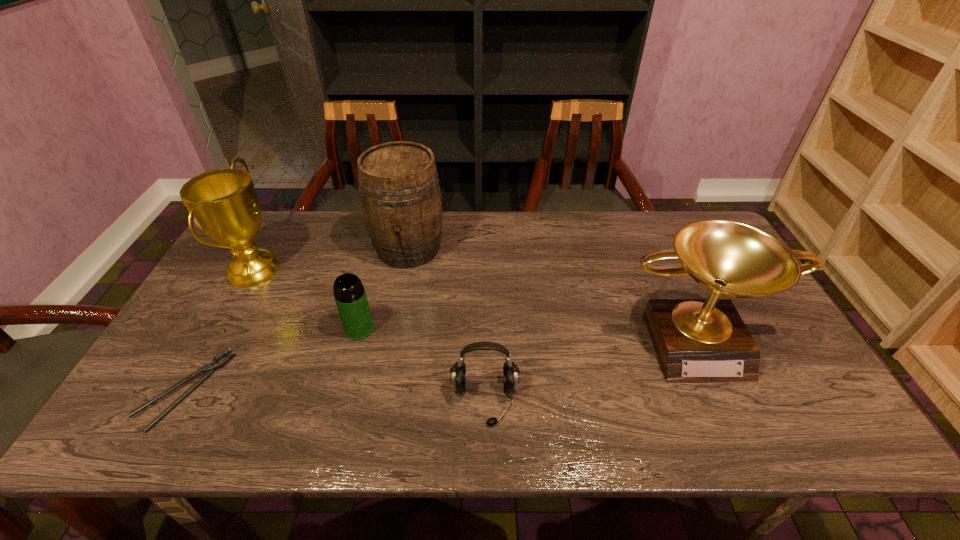
I want to click on cider, so click(x=399, y=188).

Find the location of a particular element. This screenshot has height=540, width=960. the left award is located at coordinates (223, 203).

In order to click on the rightmost object in this screenshot , I will do `click(696, 340)`.

The width and height of the screenshot is (960, 540). Identify the location of the fourth tallest object. (349, 293).

At what (x,y) coordinates should I click in order to perform the action: click on headset. Please return your answer as a coordinate pair (x, y). Looking at the image, I should click on (511, 371).

Image resolution: width=960 pixels, height=540 pixels. In order to click on the second object from right to left in this screenshot , I will do `click(511, 371)`.

Where is `the shortest object`? This screenshot has height=540, width=960. the shortest object is located at coordinates (210, 368).

Locate an element on the screen. vacant region located on the side of the cider near the bung hole is located at coordinates (393, 332).

The width and height of the screenshot is (960, 540). I want to click on free space located on the shiny surface of the left award, so click(361, 268).

This screenshot has width=960, height=540. What are the coordinates of `vacant space located 0.060m on the front-facing side of the right award` in the screenshot? It's located at (725, 405).